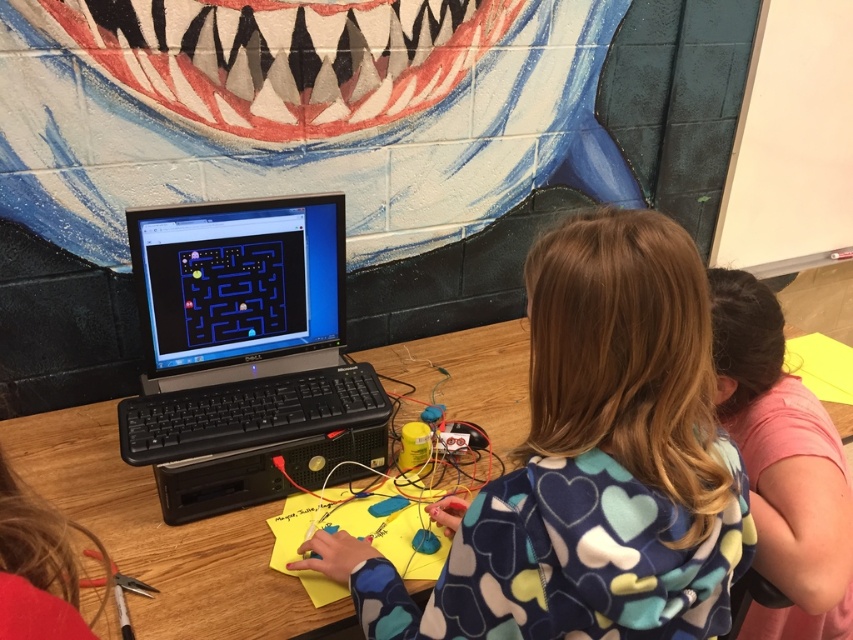
Question: Is blue heart-patterned hoodie at center thinner than pink fabric shirt at upper right?

Choices:
 (A) yes
 (B) no

Answer: (B)

Question: Is wooden table at center thinner than pink fabric shirt at upper right?

Choices:
 (A) no
 (B) yes

Answer: (A)

Question: Among these points, which one is farthest from the camera?

Choices:
 (A) (200, 352)
 (B) (112, 557)
 (C) (729, 616)
 (D) (781, 435)

Answer: (A)

Question: Which point is closer to the camera?

Choices:
 (A) (827, 614)
 (B) (177, 209)

Answer: (B)

Question: Which point is closer to the camera?

Choices:
 (A) (799, 561)
 (B) (303, 406)
 (C) (78, 480)

Answer: (A)

Question: Is black plastic laptop at center positioned behind wooden table at center?

Choices:
 (A) no
 (B) yes

Answer: (B)